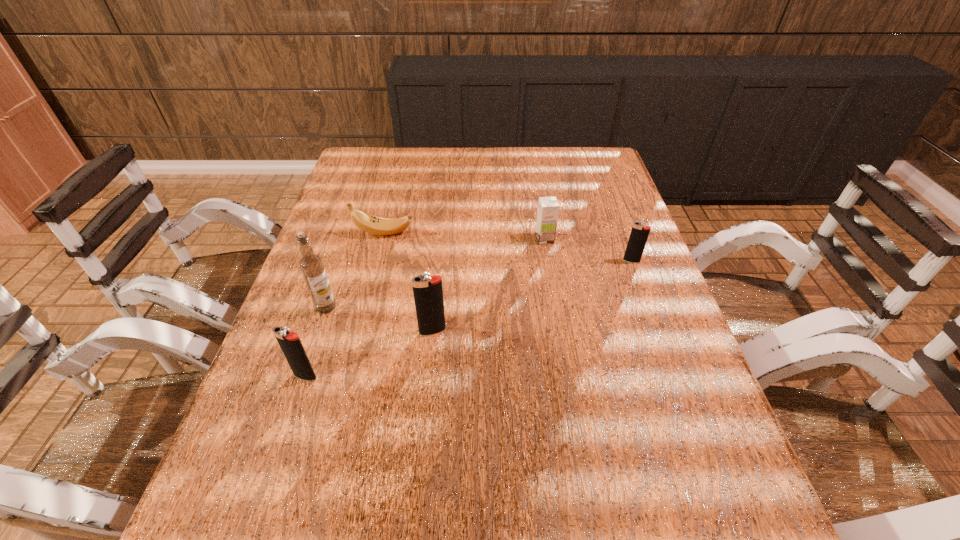
Where is `the nearest igniter`? the nearest igniter is located at coordinates (290, 343).

Locate an element on the screen. the nearest object is located at coordinates (290, 343).

I want to click on the second igniter from right to left, so (x=428, y=293).

Find the location of a particular element. the third object from right to left is located at coordinates tap(428, 293).

Locate an element on the screen. This screenshot has width=960, height=540. the third farthest object is located at coordinates (639, 234).

I want to click on the shortest igniter, so click(x=639, y=234).

The image size is (960, 540). Find the location of `the shortest object`. the shortest object is located at coordinates (371, 224).

This screenshot has height=540, width=960. What are the coordinates of `the fourth farthest object` in the screenshot? It's located at (311, 265).

This screenshot has height=540, width=960. Identify the location of the tallest object. (311, 265).

Where is `chocolate milk`? This screenshot has height=540, width=960. chocolate milk is located at coordinates (548, 207).